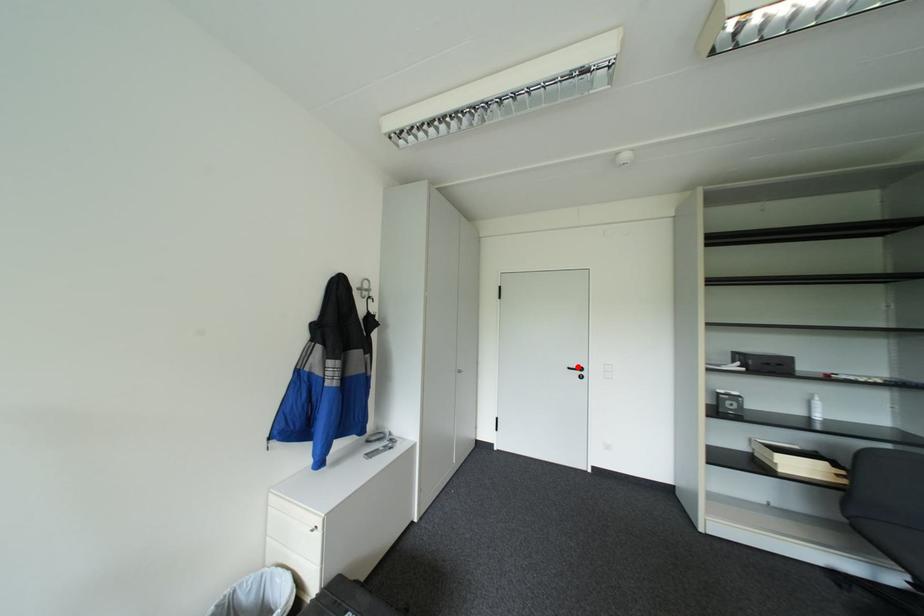
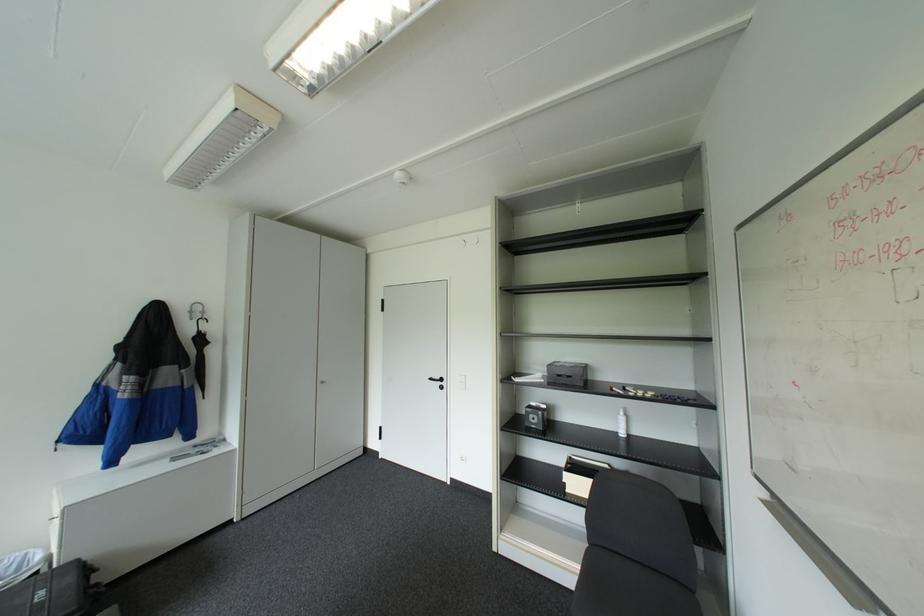
Locate, in the second image, the point that corresponds to the highlighted location in the first image.

(439, 378)